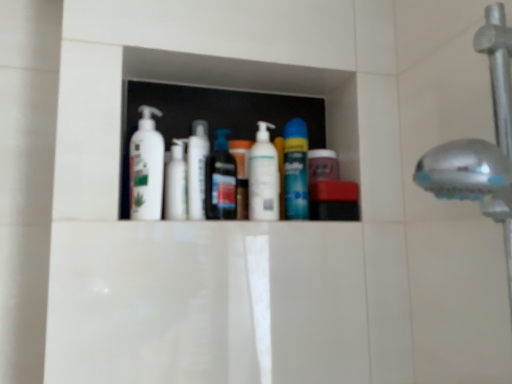
Question: From a real-world perspective, is blue glossy can at center, which is the 1th mouthwash in right-to-left order, under white glossy pump bottle at center, positioned as the third toiletry in left-to-right order?

Choices:
 (A) yes
 (B) no

Answer: (B)

Question: Does blue glossy can at center, which is the 1th mouthwash in right-to-left order, have a greater height compared to white glossy pump bottle at center, positioned as the third toiletry in left-to-right order?

Choices:
 (A) no
 (B) yes

Answer: (B)

Question: Is blue glossy can at center, which ranks as the 2th mouthwash in left-to-right order, smaller than white glossy pump bottle at center, the first toiletry from the right?

Choices:
 (A) no
 (B) yes

Answer: (A)

Question: Is blue glossy can at center, which is the 1th mouthwash in right-to-left order, placed right next to white glossy pump bottle at center, positioned as the third toiletry in left-to-right order?

Choices:
 (A) yes
 (B) no

Answer: (A)

Question: Does blue glossy can at center, which is the 1th mouthwash in right-to-left order, have a lesser width compared to white glossy pump bottle at center, positioned as the third toiletry in left-to-right order?

Choices:
 (A) yes
 (B) no

Answer: (B)

Question: Is point (285, 193) closer or farther from the camera than point (159, 216)?

Choices:
 (A) farther
 (B) closer

Answer: (A)

Question: In terms of width, does blue glossy can at center, which ranks as the 2th mouthwash in left-to-right order, look wider or thinner when compared to white matte lotion at center, positioned as the first cleaning product in left-to-right order?

Choices:
 (A) wide
 (B) thin

Answer: (B)

Question: From the image's perspective, is blue glossy can at center, which ranks as the 2th mouthwash in left-to-right order, located above or below white matte lotion at center, the second cleaning product positioned from the right?

Choices:
 (A) above
 (B) below

Answer: (B)

Question: From a real-world perspective, relative to white matte lotion at center, positioned as the first cleaning product in left-to-right order, is blue glossy can at center, which is the 1th mouthwash in right-to-left order, vertically above or below?

Choices:
 (A) below
 (B) above

Answer: (A)

Question: Based on their sizes in the image, would you say white matte lotion at center, the second cleaning product positioned from the right, is bigger or smaller than blue glossy can at center, which is the 1th mouthwash in right-to-left order?

Choices:
 (A) big
 (B) small

Answer: (A)

Question: From a real-world perspective, is white matte lotion at center, positioned as the first cleaning product in left-to-right order, positioned above or below blue glossy can at center, which ranks as the 2th mouthwash in left-to-right order?

Choices:
 (A) above
 (B) below

Answer: (A)

Question: Based on their positions, is white matte lotion at center, the second cleaning product positioned from the right, located to the left or right of blue glossy can at center, which ranks as the 2th mouthwash in left-to-right order?

Choices:
 (A) left
 (B) right

Answer: (A)

Question: Is white matte lotion at center, the second cleaning product positioned from the right, taller or shorter than blue glossy can at center, which ranks as the 2th mouthwash in left-to-right order?

Choices:
 (A) short
 (B) tall

Answer: (B)

Question: Considering the relative positions of white matte lotion at center, the second cleaning product positioned from the right, and white glossy pump bottle at center, positioned as the third toiletry in left-to-right order, in the image provided, is white matte lotion at center, the second cleaning product positioned from the right, to the left or to the right of white glossy pump bottle at center, positioned as the third toiletry in left-to-right order,?

Choices:
 (A) left
 (B) right

Answer: (A)

Question: Considering the positions of white matte lotion at center, positioned as the first cleaning product in left-to-right order, and white glossy pump bottle at center, the first toiletry from the right, in the image, is white matte lotion at center, positioned as the first cleaning product in left-to-right order, bigger or smaller than white glossy pump bottle at center, the first toiletry from the right,?

Choices:
 (A) big
 (B) small

Answer: (A)